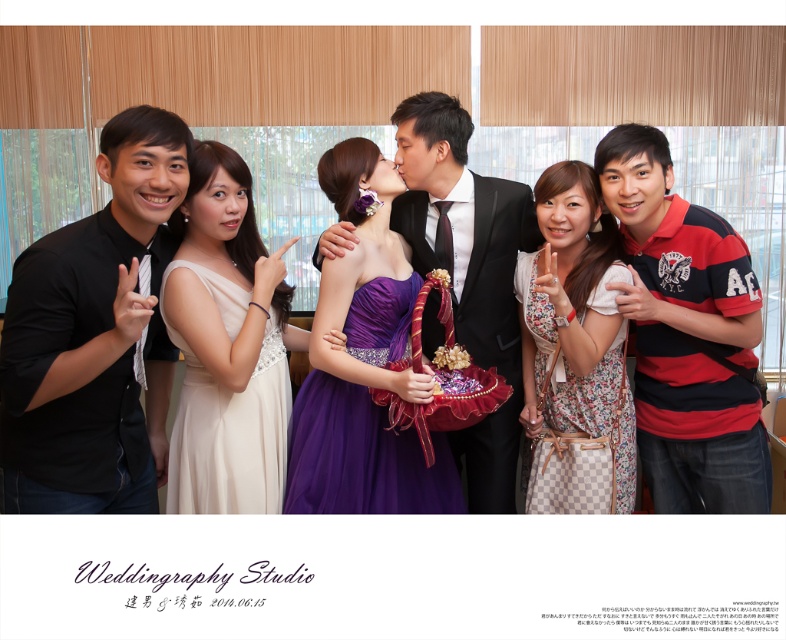
Between point (402, 460) and point (594, 394), which one is positioned in front?

Point (594, 394) is in front.

Does point (408, 289) come behind point (623, 497)?

Yes, it is behind point (623, 497).

Is point (342, 476) behind point (518, 272)?

No, it is in front of (518, 272).

You are a GUI agent. You are given a task and a screenshot of the screen. Output one action in this format:
    pyautogui.click(x=<x>, y=<y>)
    Task: Click on the purple satin dress at center
    Image resolution: width=786 pixels, height=640 pixels.
    Given the screenshot: What is the action you would take?
    pyautogui.click(x=362, y=456)

Which of these two, black satin suit at center or purple satin dress at center, stands shorter?

Standing shorter between the two is purple satin dress at center.

Is point (456, 241) positioned behind point (401, 497)?

Yes, point (456, 241) is behind point (401, 497).

Is point (461, 234) closer to viewer compared to point (318, 490)?

No, it is not.

This screenshot has width=786, height=640. What are the coordinates of `black satin suit at center` in the screenshot? It's located at tap(468, 272).

Who is positioned more to the right, red striped polo shirt at right or floral cotton dress at center?

From the viewer's perspective, red striped polo shirt at right appears more on the right side.

Can you confirm if red striped polo shirt at right is thinner than floral cotton dress at center?

Incorrect, red striped polo shirt at right's width is not less than floral cotton dress at center's.

Where is `red striped polo shirt at right`? Image resolution: width=786 pixels, height=640 pixels. red striped polo shirt at right is located at coordinates (687, 336).